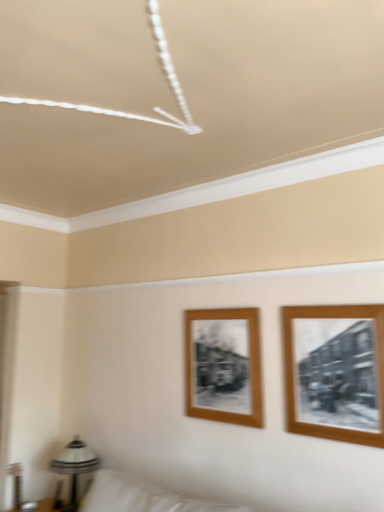
The image size is (384, 512). Describe the element at coordinates (75, 466) in the screenshot. I see `metallic silver table lamp at lower left` at that location.

What do you see at coordinates (224, 366) in the screenshot? This screenshot has height=512, width=384. I see `wooden frame at center, which is counted as the first picture frame, starting from the back` at bounding box center [224, 366].

At what (x,y) coordinates should I click in order to perform the action: click on wooden frame at center, positioned as the 2th picture frame in front-to-back order. Please return your answer as a coordinate pair (x, y). The image size is (384, 512). Looking at the image, I should click on (224, 366).

Locate an element on the screen. This screenshot has width=384, height=512. metallic silver table lamp at lower left is located at coordinates (75, 466).

From a real-world perspective, which is physically below, metallic silver table lamp at lower left or wooden framed photo at right, which is the first picture frame from front to back?

From a 3D spatial view, metallic silver table lamp at lower left is below.

Which of these two, metallic silver table lamp at lower left or wooden framed photo at right, the 2th picture frame from the back, is wider?

Wider between the two is metallic silver table lamp at lower left.

Which of these two, metallic silver table lamp at lower left or wooden framed photo at right, the 2th picture frame from the back, stands shorter?

→ With less height is metallic silver table lamp at lower left.

Is metallic silver table lamp at lower left oriented towards wooden framed photo at right, which is the first picture frame from front to back?

No, metallic silver table lamp at lower left is not facing towards wooden framed photo at right, which is the first picture frame from front to back.

Is wooden frame at center, marked as the 2th picture frame in a right-to-left arrangement, at the back of metallic silver table lamp at lower left?

That's not correct — metallic silver table lamp at lower left is not looking away from wooden frame at center, marked as the 2th picture frame in a right-to-left arrangement.

How far apart are metallic silver table lamp at lower left and wooden frame at center, marked as the 2th picture frame in a right-to-left arrangement?

metallic silver table lamp at lower left and wooden frame at center, marked as the 2th picture frame in a right-to-left arrangement, are 3.50 feet apart from each other.

Is metallic silver table lamp at lower left wider than wooden frame at center, which is counted as the first picture frame, starting from the back?

Yes.

From a real-world perspective, is metallic silver table lamp at lower left positioned above or below wooden frame at center, marked as the 2th picture frame in a right-to-left arrangement?

In terms of real-world spatial position, metallic silver table lamp at lower left is below wooden frame at center, marked as the 2th picture frame in a right-to-left arrangement.

Is wooden framed photo at right, positioned as the first picture frame in right-to-left order, oriented away from wooden frame at center, marked as the 2th picture frame in a right-to-left arrangement?

No, wooden framed photo at right, positioned as the first picture frame in right-to-left order, is not facing the opposite direction of wooden frame at center, marked as the 2th picture frame in a right-to-left arrangement.

Identify the location of picture frame in front of the wooden frame at center, which ranks as the 1th picture frame in left-to-right order. (335, 372).

Is wooden framed photo at right, which is the first picture frame from front to back, inside the boundaries of wooden frame at center, which ranks as the 1th picture frame in left-to-right order, or outside?

wooden framed photo at right, which is the first picture frame from front to back, is located beyond the bounds of wooden frame at center, which ranks as the 1th picture frame in left-to-right order.

From the picture: Is wooden frame at center, which is counted as the first picture frame, starting from the back, to the right of metallic silver table lamp at lower left from the viewer's perspective?

Correct, you'll find wooden frame at center, which is counted as the first picture frame, starting from the back, to the right of metallic silver table lamp at lower left.

Is point (210, 388) positioned after point (73, 480)?

No, it is not.

Which of these two, wooden frame at center, positioned as the 2th picture frame in front-to-back order, or metallic silver table lamp at lower left, is wider?

Wider between the two is metallic silver table lamp at lower left.

Is wooden frame at center, marked as the 2th picture frame in a right-to-left arrangement, facing towards metallic silver table lamp at lower left?

No, wooden frame at center, marked as the 2th picture frame in a right-to-left arrangement, is not turned towards metallic silver table lamp at lower left.

Is wooden frame at center, which is counted as the first picture frame, starting from the back, oriented away from wooden framed photo at right, positioned as the first picture frame in right-to-left order?

No, wooden frame at center, which is counted as the first picture frame, starting from the back, is not facing the opposite direction of wooden framed photo at right, positioned as the first picture frame in right-to-left order.

Is wooden frame at center, which ranks as the 1th picture frame in left-to-right order, outside of wooden framed photo at right, positioned as the first picture frame in right-to-left order?

That's correct, wooden frame at center, which ranks as the 1th picture frame in left-to-right order, is outside of wooden framed photo at right, positioned as the first picture frame in right-to-left order.

Can you confirm if wooden frame at center, marked as the 2th picture frame in a right-to-left arrangement, is smaller than wooden framed photo at right, positioned as the first picture frame in right-to-left order?

Yes, wooden frame at center, marked as the 2th picture frame in a right-to-left arrangement, is smaller than wooden framed photo at right, positioned as the first picture frame in right-to-left order.

From a real-world perspective, does wooden frame at center, positioned as the 2th picture frame in front-to-back order, stand above wooden framed photo at right, positioned as the first picture frame in right-to-left order?

No, from a real-world perspective, wooden frame at center, positioned as the 2th picture frame in front-to-back order, is not above wooden framed photo at right, positioned as the first picture frame in right-to-left order.

From a real-world perspective, who is located lower, wooden framed photo at right, which is the first picture frame from front to back, or metallic silver table lamp at lower left?

metallic silver table lamp at lower left.

Is wooden framed photo at right, positioned as the first picture frame in right-to-left order, oriented towards metallic silver table lamp at lower left?

No, wooden framed photo at right, positioned as the first picture frame in right-to-left order, does not turn towards metallic silver table lamp at lower left.

Is the surface of wooden framed photo at right, the 2th picture frame from the back, in direct contact with metallic silver table lamp at lower left?

There is a gap between wooden framed photo at right, the 2th picture frame from the back, and metallic silver table lamp at lower left.

Do you think wooden framed photo at right, which is the first picture frame from front to back, is within metallic silver table lamp at lower left, or outside of it?

wooden framed photo at right, which is the first picture frame from front to back, cannot be found inside metallic silver table lamp at lower left.

Starting from the metallic silver table lamp at lower left, which picture frame is the 2nd one in front? Please provide its 2D coordinates.

[(335, 372)]

This screenshot has width=384, height=512. I want to click on table lamp to the left of wooden frame at center, positioned as the 2th picture frame in front-to-back order, so click(75, 466).

Based on their spatial positions, is wooden frame at center, positioned as the 2th picture frame in front-to-back order, or wooden framed photo at right, which is the first picture frame from front to back, further from metallic silver table lamp at lower left?

Based on the image, wooden framed photo at right, which is the first picture frame from front to back, appears to be further to metallic silver table lamp at lower left.

Based on their spatial positions, is metallic silver table lamp at lower left or wooden frame at center, which ranks as the 1th picture frame in left-to-right order, closer to wooden framed photo at right, the 2th picture frame from the back?

The object closer to wooden framed photo at right, the 2th picture frame from the back, is wooden frame at center, which ranks as the 1th picture frame in left-to-right order.

Looking at the image, which one is located further to metallic silver table lamp at lower left, wooden framed photo at right, which is the first picture frame from front to back, or wooden frame at center, positioned as the 2th picture frame in front-to-back order?

Among the two, wooden framed photo at right, which is the first picture frame from front to back, is located further to metallic silver table lamp at lower left.

Estimate the real-world distances between objects in this image. Which object is closer to wooden frame at center, positioned as the 2th picture frame in front-to-back order, wooden framed photo at right, which is the first picture frame from front to back, or metallic silver table lamp at lower left?

Among the two, wooden framed photo at right, which is the first picture frame from front to back, is located nearer to wooden frame at center, positioned as the 2th picture frame in front-to-back order.

Estimate the real-world distances between objects in this image. Which object is closer to wooden frame at center, which is counted as the first picture frame, starting from the back, metallic silver table lamp at lower left or wooden framed photo at right, the 2th picture frame from the back?

wooden framed photo at right, the 2th picture frame from the back, is closer to wooden frame at center, which is counted as the first picture frame, starting from the back.

Estimate the real-world distances between objects in this image. Which object is further from wooden framed photo at right, which is the first picture frame from front to back, wooden frame at center, marked as the 2th picture frame in a right-to-left arrangement, or metallic silver table lamp at lower left?

metallic silver table lamp at lower left is positioned further to the anchor wooden framed photo at right, which is the first picture frame from front to back.

The width and height of the screenshot is (384, 512). In order to click on picture frame between metallic silver table lamp at lower left and wooden framed photo at right, which is the first picture frame from front to back, from left to right in this screenshot , I will do `click(224, 366)`.